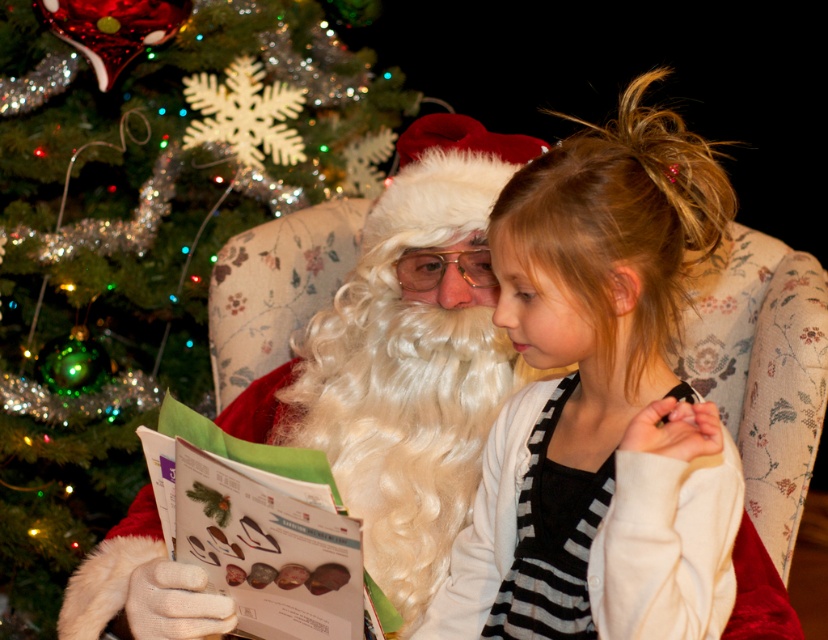
Between green glittery christmas tree at left and white cardigan at center, which one has less height?

white cardigan at center is shorter.

Does green glittery christmas tree at left have a greater width compared to white cardigan at center?

Correct, the width of green glittery christmas tree at left exceeds that of white cardigan at center.

Is point (95, 525) farther from camera compared to point (586, 184)?

Yes, point (95, 525) is behind point (586, 184).

Where is `green glittery christmas tree at left`? Image resolution: width=828 pixels, height=640 pixels. green glittery christmas tree at left is located at coordinates (138, 236).